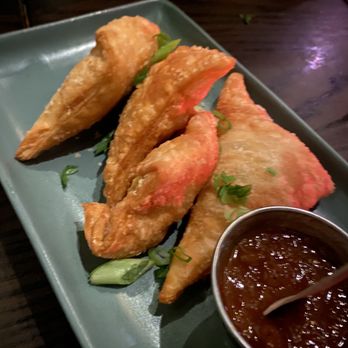
Where is `edge of plate`? Image resolution: width=348 pixels, height=348 pixels. edge of plate is located at coordinates (48, 276), (33, 27), (272, 98).